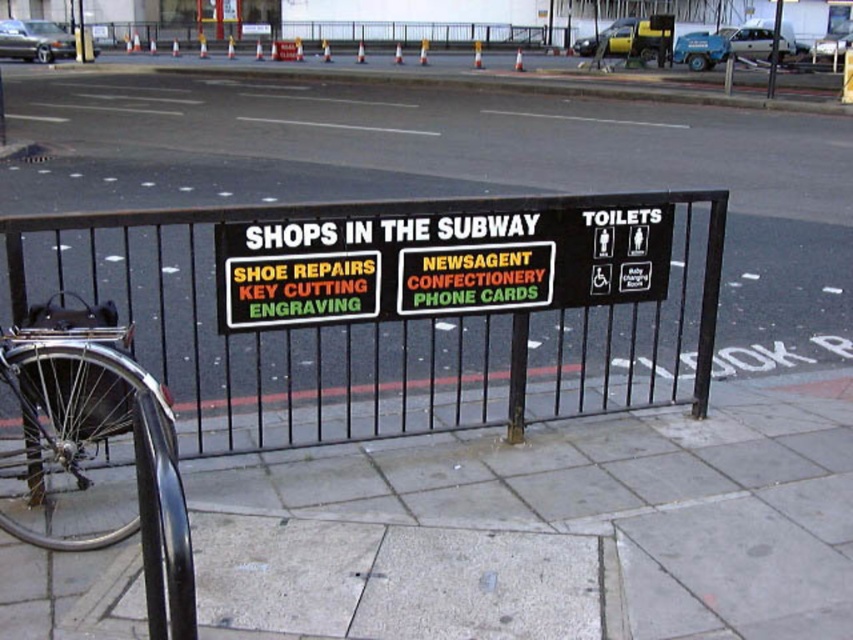
You are standing in a subway station and want to reach the black metal fence at center to read the sign. If you can walk 1.2 meters per second, how many seconds will it take you to reach the fence?

The black metal fence at center is 4.81 meters away from the viewer. At a walking speed of 1.2 meters per second, it will take approximately 4.81 divided by 1.2, which is about 4.01 seconds to reach the fence.

What is the location of the point with coordinates (398, 310) in relation to the black metal railing?

The point with coordinates (398, 310) is located on the black metal fence at center.

What is the location of the point with coordinates (398, 310) in relation to the black metal railing?

The point with coordinates (398, 310) is located on the black metal fence at center.